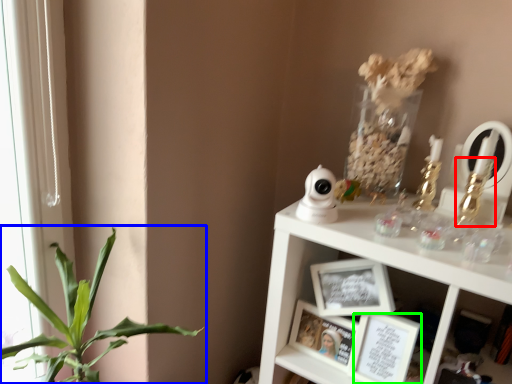
Question: Estimate the real-world distances between objects in this image. Which object is closer to toy (highlighted by a red box), houseplant (highlighted by a blue box) or picture frame (highlighted by a green box)?

Choices:
 (A) houseplant
 (B) picture frame

Answer: (B)